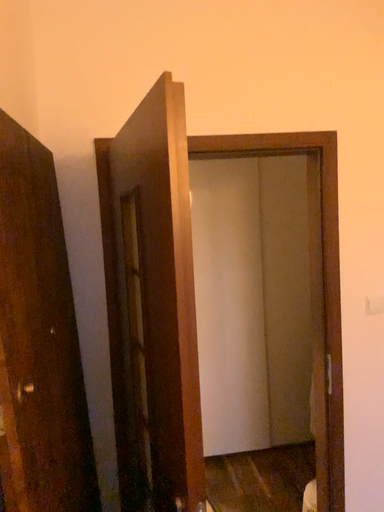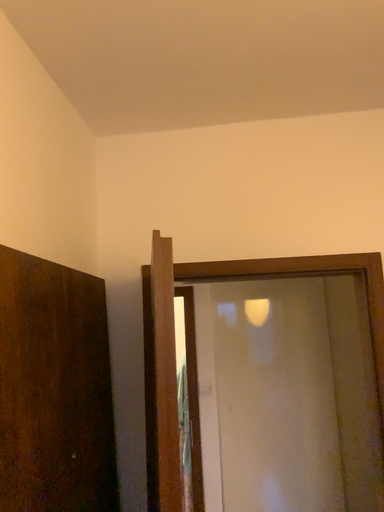
Question: Which way did the camera rotate in the video?

Choices:
 (A) rotated left
 (B) rotated right

Answer: (A)